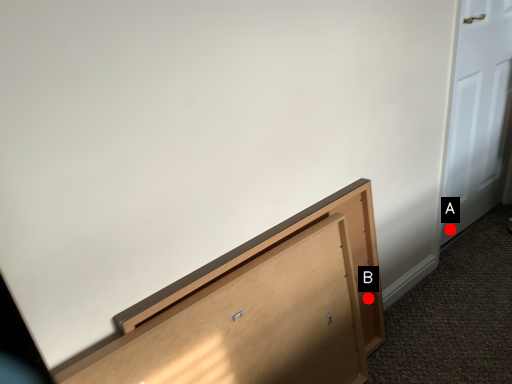
Question: Two points are circled on the image, labeled by A and B beside each circle. Which point is closer to the camera?

Choices:
 (A) A is closer
 (B) B is closer

Answer: (B)